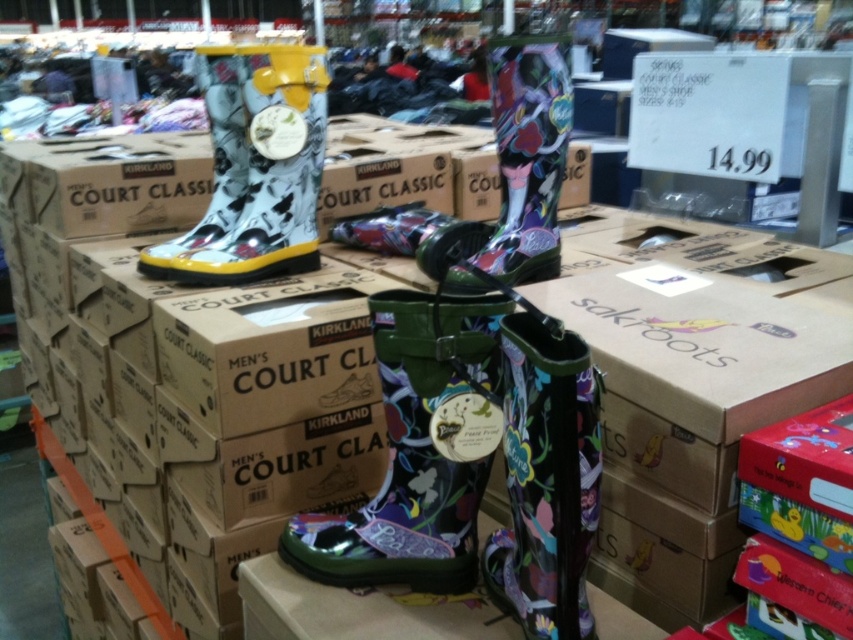
Question: Among these points, which one is farthest from the camera?

Choices:
 (A) (384, 554)
 (B) (550, 147)
 (C) (577, 440)

Answer: (B)

Question: Considering the real-world distances, which object is farthest from the floral-patterned rubber boot at center?

Choices:
 (A) green glossy rain boot at center
 (B) matte rubber boot at upper left

Answer: (B)

Question: Which object is closer to the camera taking this photo?

Choices:
 (A) shiny floral-patterned boot at center
 (B) matte rubber boot at upper left

Answer: (A)

Question: Considering the relative positions of floral-patterned rubber boot at center and shiny floral-patterned boot at center in the image provided, where is floral-patterned rubber boot at center located with respect to shiny floral-patterned boot at center?

Choices:
 (A) left
 (B) right

Answer: (A)

Question: Is the position of floral-patterned rubber boot at center less distant than that of matte rubber boot at upper left?

Choices:
 (A) no
 (B) yes

Answer: (B)

Question: Is shiny floral-patterned boot at center in front of matte rubber boot at upper left?

Choices:
 (A) no
 (B) yes

Answer: (B)